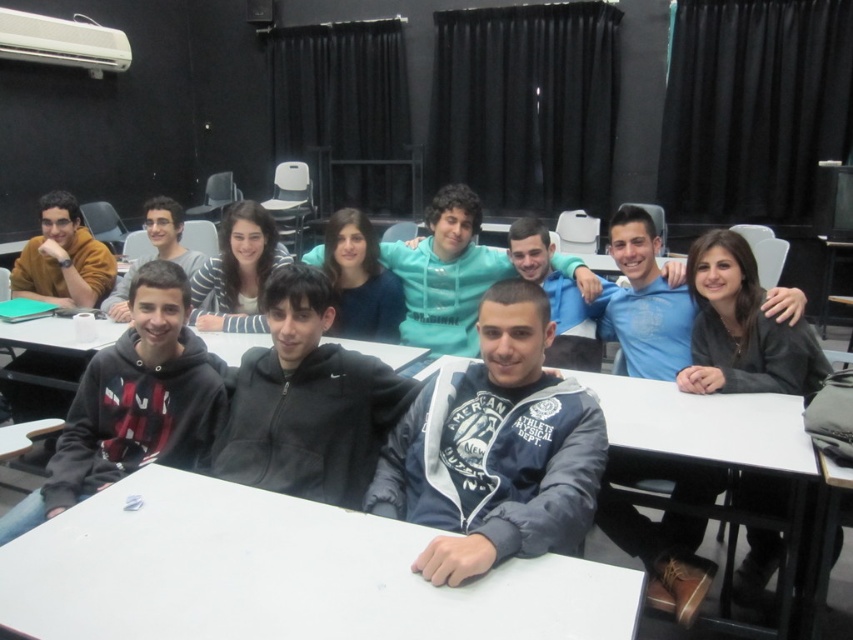
Is the position of white matte table at center less distant than that of dark gray sweater at center?

Yes, it is in front of dark gray sweater at center.

Who is more distant from viewer, (x=503, y=588) or (x=747, y=477)?

Point (x=747, y=477)

Who is more distant from viewer, (x=532, y=564) or (x=708, y=257)?

Positioned behind is point (x=708, y=257).

This screenshot has width=853, height=640. I want to click on white matte table at center, so click(279, 573).

Is blue fabric jacket at center thinner than black fleece hoodie at left?

In fact, blue fabric jacket at center might be wider than black fleece hoodie at left.

Who is more forward, (488, 458) or (206, 449)?

Point (488, 458)

Locate an element on the screen. The height and width of the screenshot is (640, 853). blue fabric jacket at center is located at coordinates (495, 449).

Which of these two, blue fabric jacket at center or striped fabric shirt at center, stands shorter?

striped fabric shirt at center is shorter.

The height and width of the screenshot is (640, 853). What do you see at coordinates (495, 449) in the screenshot?
I see `blue fabric jacket at center` at bounding box center [495, 449].

Is point (508, 388) positioned in front of point (253, 282)?

That is True.

Where is `blue fabric jacket at center`? The image size is (853, 640). blue fabric jacket at center is located at coordinates (495, 449).